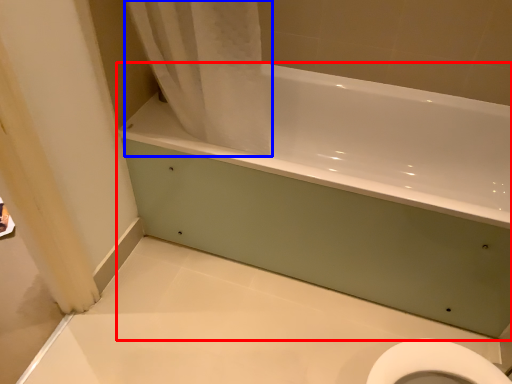
Question: Which object is closer to the camera taking this photo, bathtub (highlighted by a red box) or shower curtain (highlighted by a blue box)?

Choices:
 (A) bathtub
 (B) shower curtain

Answer: (B)